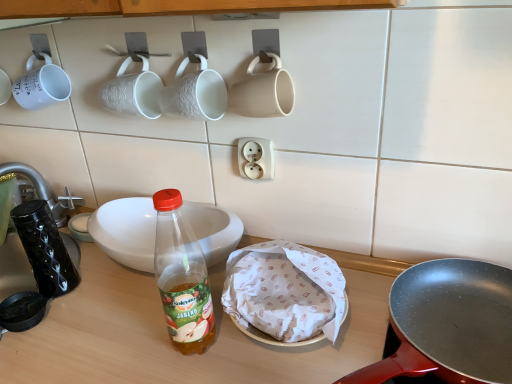
Where is `vacant area located to the right-hand side of black glossy coffee cup at left`? This screenshot has width=512, height=384. vacant area located to the right-hand side of black glossy coffee cup at left is located at coordinates (114, 297).